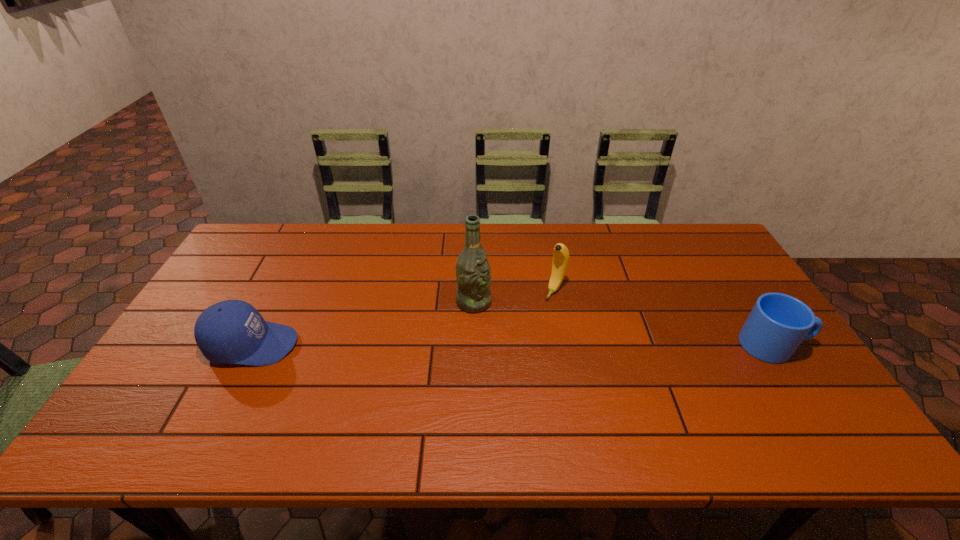
I want to click on object that ranks as the second closest to the leftmost object, so click(x=560, y=262).

Locate an element on the screen. This screenshot has width=960, height=540. the closest object to the cap is located at coordinates (473, 274).